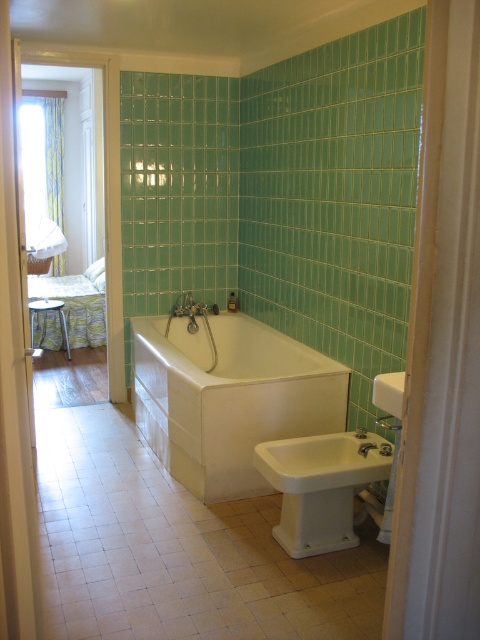
Between white ceramic sink at lower center and matte white shower at center, which one has less height?

matte white shower at center

Does white ceramic sink at lower center appear under matte white shower at center?

Indeed, white ceramic sink at lower center is positioned under matte white shower at center.

Does point (307, 556) come in front of point (387, 417)?

Yes, point (307, 556) is closer to viewer.

This screenshot has height=640, width=480. What are the coordinates of `white ceramic sink at lower center` in the screenshot? It's located at (321, 486).

This screenshot has width=480, height=640. What do you see at coordinates (228, 397) in the screenshot? I see `white glossy bathtub at center` at bounding box center [228, 397].

Is the position of white glossy bathtub at center more distant than that of white ceramic sink at center?

Yes, white glossy bathtub at center is behind white ceramic sink at center.

Find the location of a particular element. The width and height of the screenshot is (480, 640). white glossy bathtub at center is located at coordinates (228, 397).

You are a GUI agent. You are given a task and a screenshot of the screen. Output one action in this format:
    pyautogui.click(x=<x>, y=<y>)
    Task: Click on the white ceramic sink at lower right
    The width and height of the screenshot is (480, 640).
    Given the screenshot: What is the action you would take?
    pyautogui.click(x=323, y=461)